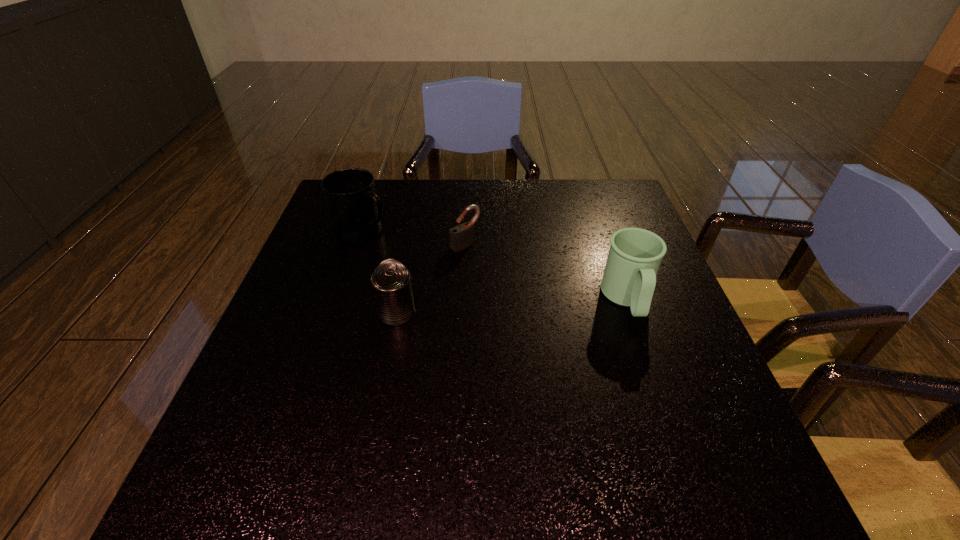
Where is `the second object from left to right`? The image size is (960, 540). the second object from left to right is located at coordinates (391, 282).

Locate an element on the screen. The height and width of the screenshot is (540, 960). the nearer mug is located at coordinates (635, 254).

Find the location of `the right mug`. the right mug is located at coordinates (635, 254).

You are a GUI agent. You are given a task and a screenshot of the screen. Output one action in this format:
    pyautogui.click(x=<x>, y=<y>)
    Task: Click on the leftmost object
    
    Given the screenshot: What is the action you would take?
    pyautogui.click(x=355, y=210)

Identify the location of the farther mug. The height and width of the screenshot is (540, 960). (355, 210).

You are a GUI agent. You are given a task and a screenshot of the screen. Output one action in this format:
    pyautogui.click(x=<x>, y=<y>)
    Task: Click on the shortest object
    
    Given the screenshot: What is the action you would take?
    pyautogui.click(x=462, y=236)

At what (x,y) coordinates should I click in order to perform the action: click on padlock. Please return your answer as a coordinate pair (x, y). Looking at the image, I should click on (462, 236).

Find the location of a particular element. free space located on the right of the third object from right to left is located at coordinates (481, 313).

This screenshot has width=960, height=540. Find the location of `free location located 0.050m on the side of the nearer mug with the handle`. free location located 0.050m on the side of the nearer mug with the handle is located at coordinates (643, 345).

This screenshot has width=960, height=540. Find the location of `vacant position located 0.080m on the side of the leftmost object with the handle`. vacant position located 0.080m on the side of the leftmost object with the handle is located at coordinates (407, 249).